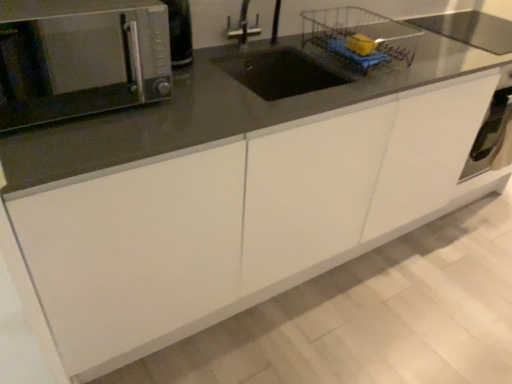
Question: From a real-world perspective, does wire mesh basket at upper center stand above satin silver oven at lower right?

Choices:
 (A) yes
 (B) no

Answer: (A)

Question: Is satin silver oven at lower right at the back of wire mesh basket at upper center?

Choices:
 (A) no
 (B) yes

Answer: (A)

Question: Does wire mesh basket at upper center have a greater height compared to satin silver oven at lower right?

Choices:
 (A) yes
 (B) no

Answer: (B)

Question: Can you confirm if wire mesh basket at upper center is smaller than satin silver oven at lower right?

Choices:
 (A) yes
 (B) no

Answer: (B)

Question: Is the position of wire mesh basket at upper center less distant than that of satin silver oven at lower right?

Choices:
 (A) yes
 (B) no

Answer: (A)

Question: From the image's perspective, is satin silver microwave at upper left positioned above or below yellow sponge at upper right?

Choices:
 (A) below
 (B) above

Answer: (A)

Question: Is satin silver microwave at upper left bigger or smaller than yellow sponge at upper right?

Choices:
 (A) big
 (B) small

Answer: (A)

Question: Considering the positions of point (122, 14) and point (355, 41), is point (122, 14) closer or farther from the camera than point (355, 41)?

Choices:
 (A) closer
 (B) farther

Answer: (A)

Question: From a real-world perspective, relative to yellow sponge at upper right, is satin silver microwave at upper left vertically above or below?

Choices:
 (A) above
 (B) below

Answer: (A)

Question: Is point (375, 39) positioned closer to the camera than point (492, 99)?

Choices:
 (A) farther
 (B) closer

Answer: (B)

Question: Would you say wire mesh basket at upper center is to the left or to the right of satin silver oven at lower right in the picture?

Choices:
 (A) left
 (B) right

Answer: (A)

Question: From a real-world perspective, is wire mesh basket at upper center positioned above or below satin silver oven at lower right?

Choices:
 (A) below
 (B) above

Answer: (B)

Question: Is wire mesh basket at upper center bigger or smaller than satin silver oven at lower right?

Choices:
 (A) big
 (B) small

Answer: (A)

Question: In terms of size, does yellow sponge at upper right appear bigger or smaller than satin silver oven at lower right?

Choices:
 (A) small
 (B) big

Answer: (A)

Question: Considering their positions, is yellow sponge at upper right located in front of or behind satin silver oven at lower right?

Choices:
 (A) behind
 (B) front

Answer: (B)